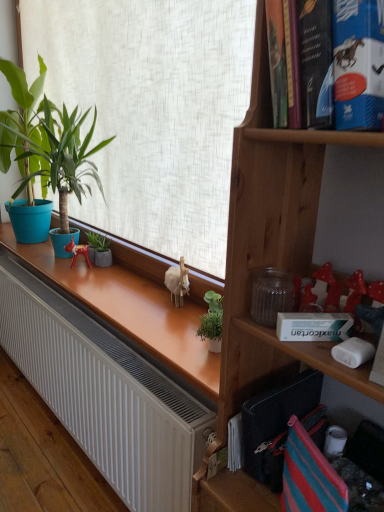
Question: Is white matte radiator at lower left oriented towards green matte plant at left, placed as the first houseplant when sorted from top to bottom?

Choices:
 (A) yes
 (B) no

Answer: (B)

Question: Does white matte radiator at lower left contain green matte plant at left, positioned as the first houseplant in front-to-back order?

Choices:
 (A) yes
 (B) no

Answer: (B)

Question: Is white matte radiator at lower left wider than green matte plant at left, positioned as the first houseplant in front-to-back order?

Choices:
 (A) yes
 (B) no

Answer: (A)

Question: From the image's perspective, is white matte radiator at lower left on top of green matte plant at left, which ranks as the second houseplant in bottom-to-top order?

Choices:
 (A) no
 (B) yes

Answer: (A)

Question: Does white matte radiator at lower left have a smaller size compared to green matte plant at left, positioned as the first houseplant in front-to-back order?

Choices:
 (A) yes
 (B) no

Answer: (A)

Question: Considering the positions of blue cardboard book at upper right and green matte plant at left, which ranks as the second houseplant in bottom-to-top order, in the image, is blue cardboard book at upper right taller or shorter than green matte plant at left, which ranks as the second houseplant in bottom-to-top order,?

Choices:
 (A) tall
 (B) short

Answer: (B)

Question: Is blue cardboard book at upper right inside the boundaries of green matte plant at left, placed as the first houseplant when sorted from top to bottom, or outside?

Choices:
 (A) inside
 (B) outside

Answer: (B)

Question: Is point (342, 86) positioned closer to the camera than point (82, 193)?

Choices:
 (A) farther
 (B) closer

Answer: (B)

Question: Is blue cardboard book at upper right bigger or smaller than green matte plant at left, which ranks as the second houseplant in bottom-to-top order?

Choices:
 (A) small
 (B) big

Answer: (A)

Question: From the image's perspective, is green matte planter at center, which is counted as the 1th houseplant, starting from the back, located above or below white matte radiator at lower left?

Choices:
 (A) below
 (B) above

Answer: (B)

Question: From their relative heights in the image, would you say green matte planter at center, which is counted as the 1th houseplant, starting from the back, is taller or shorter than white matte radiator at lower left?

Choices:
 (A) tall
 (B) short

Answer: (A)

Question: Visually, is green matte planter at center, which is the 1th houseplant in bottom-to-top order, positioned to the left or to the right of white matte radiator at lower left?

Choices:
 (A) right
 (B) left

Answer: (A)

Question: Does point (89, 257) appear closer or farther from the camera than point (182, 424)?

Choices:
 (A) closer
 (B) farther

Answer: (B)

Question: Considering the positions of point (89, 258) and point (370, 89), is point (89, 258) closer or farther from the camera than point (370, 89)?

Choices:
 (A) farther
 (B) closer

Answer: (A)

Question: In the image, is metallic red figurine at center positioned in front of or behind blue cardboard book at upper right?

Choices:
 (A) front
 (B) behind

Answer: (B)